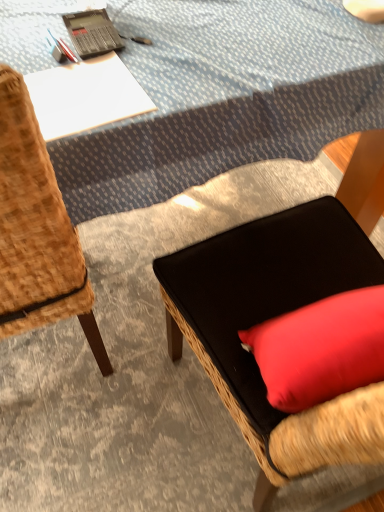
Question: Is point (130, 150) closer or farther from the camera than point (109, 36)?

Choices:
 (A) farther
 (B) closer

Answer: (B)

Question: In the image, is blue textured tablecloth at upper center on the left side or the right side of black plastic calculator at upper left?

Choices:
 (A) left
 (B) right

Answer: (B)

Question: Based on their relative distances, which object is nearer to the white paper at upper left?

Choices:
 (A) black plastic calculator at upper left
 (B) blue textured tablecloth at upper center
 (C) woven wood chair at left, which is counted as the second chair, starting from the right
 (D) black fabric cushion at center, which is the second chair in left-to-right order

Answer: (A)

Question: Estimate the real-world distances between objects in this image. Which object is farther from the blue textured tablecloth at upper center?

Choices:
 (A) black fabric cushion at center, which is the second chair in left-to-right order
 (B) woven wood chair at left, which appears as the 1th chair when viewed from the left
 (C) white paper at upper left
 (D) black plastic calculator at upper left

Answer: (B)